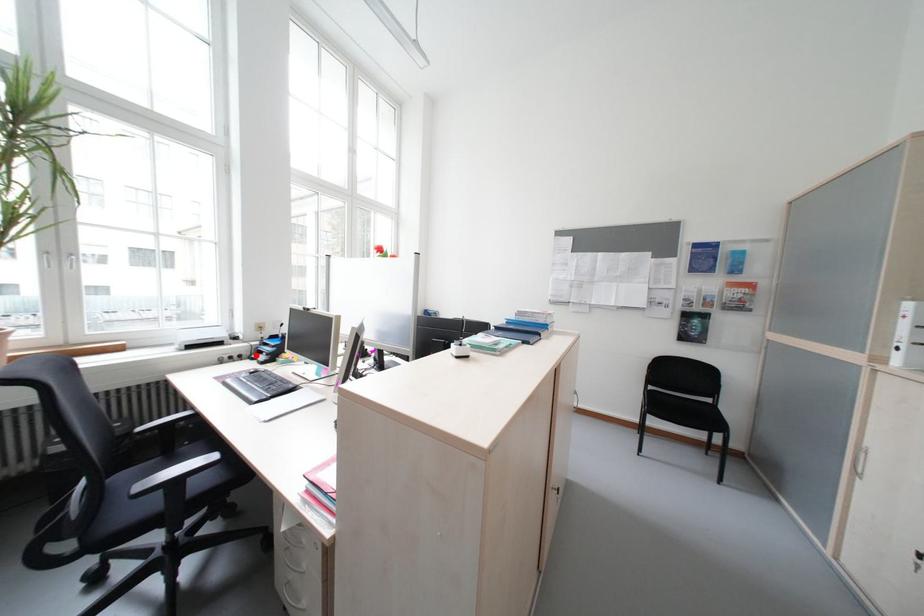
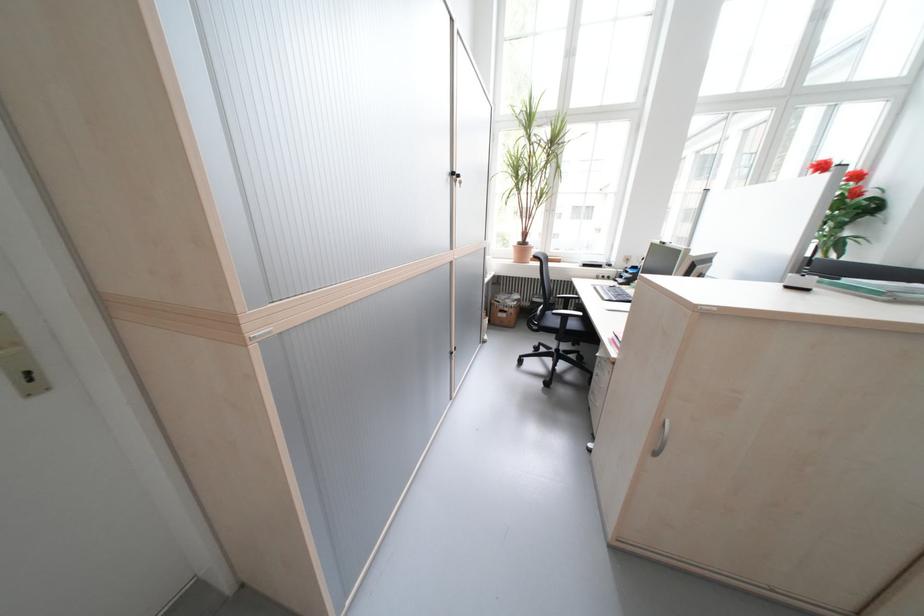
Question: A red point is marked in image1. In image2, is the corresponding 3D point closer to the camera or farther? Reply with the corresponding letter.

Choices:
 (A) The corresponding 3D point is closer.
 (B) The corresponding 3D point is farther.

Answer: (A)